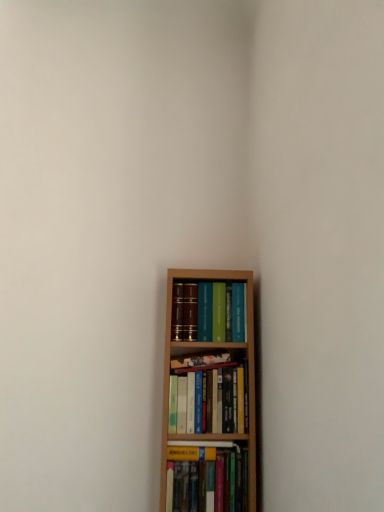
Question: Is matte hardcover books at center, marked as the first book in a top-to-bottom arrangement, inside hardcover books at center, arranged as the 2th book when ordered from the bottom?

Choices:
 (A) yes
 (B) no

Answer: (B)

Question: From the image's perspective, is hardcover books at center, arranged as the third book when viewed from the top, below matte hardcover books at center, marked as the first book in a top-to-bottom arrangement?

Choices:
 (A) no
 (B) yes

Answer: (B)

Question: Can you confirm if hardcover books at center, arranged as the 2th book when ordered from the bottom, is taller than matte hardcover books at center, marked as the first book in a top-to-bottom arrangement?

Choices:
 (A) yes
 (B) no

Answer: (A)

Question: From a real-world perspective, is hardcover books at center, arranged as the 2th book when ordered from the bottom, below matte hardcover books at center, the fourth book in the bottom-to-top sequence?

Choices:
 (A) no
 (B) yes

Answer: (B)

Question: Can you see hardcover books at center, arranged as the third book when viewed from the top, touching matte hardcover books at center, marked as the first book in a top-to-bottom arrangement?

Choices:
 (A) no
 (B) yes

Answer: (A)

Question: Could you tell me if hardcover books at center, arranged as the 2th book when ordered from the bottom, is turned towards matte hardcover books at center, marked as the first book in a top-to-bottom arrangement?

Choices:
 (A) yes
 (B) no

Answer: (B)

Question: Are hardcover books at center, arranged as the third book when viewed from the top, and hardcover book at center, which is the 2th book in top-to-bottom order, beside each other?

Choices:
 (A) no
 (B) yes

Answer: (B)

Question: Can you confirm if hardcover books at center, arranged as the third book when viewed from the top, is smaller than hardcover book at center, which is the 2th book in top-to-bottom order?

Choices:
 (A) no
 (B) yes

Answer: (A)

Question: From a real-world perspective, does hardcover books at center, arranged as the 2th book when ordered from the bottom, sit lower than hardcover book at center, which is the 2th book in top-to-bottom order?

Choices:
 (A) yes
 (B) no

Answer: (A)

Question: Is hardcover books at center, arranged as the third book when viewed from the top, wider than hardcover book at center, which is the 2th book in top-to-bottom order?

Choices:
 (A) no
 (B) yes

Answer: (B)

Question: Considering the relative sizes of hardcover books at center, arranged as the 2th book when ordered from the bottom, and hardcover book at center, which is the 2th book in top-to-bottom order, in the image provided, is hardcover books at center, arranged as the 2th book when ordered from the bottom, shorter than hardcover book at center, which is the 2th book in top-to-bottom order,?

Choices:
 (A) yes
 (B) no

Answer: (B)

Question: Is the position of hardcover books at center, arranged as the 2th book when ordered from the bottom, more distant than that of hardcover book at center, which ranks as the 3th book in bottom-to-top order?

Choices:
 (A) no
 (B) yes

Answer: (A)

Question: Is hardcover book at lower center, which is the 1th book in bottom-to-top order, oriented away from hardcover books at center, arranged as the 2th book when ordered from the bottom?

Choices:
 (A) yes
 (B) no

Answer: (B)